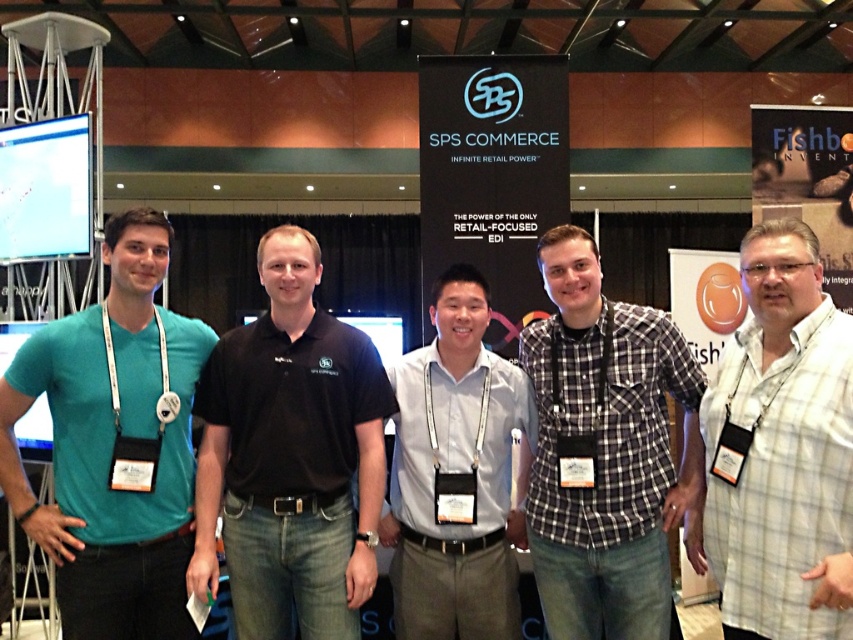
Question: Among these objects, which one is nearest to the camera?

Choices:
 (A) black cotton polo shirt at center
 (B) light gray shirt at center
 (C) checkered fabric shirt at center

Answer: (A)

Question: Is white checkered shirt at center closer to camera compared to light gray shirt at center?

Choices:
 (A) no
 (B) yes

Answer: (B)

Question: Can you confirm if white checkered shirt at center is positioned to the right of checkered fabric shirt at center?

Choices:
 (A) no
 (B) yes

Answer: (B)

Question: Which of the following is the farthest from the observer?

Choices:
 (A) black cotton polo shirt at center
 (B) white checkered shirt at center
 (C) checkered fabric shirt at center
 (D) teal matte t-shirt at left

Answer: (C)

Question: Considering the relative positions of black cotton polo shirt at center and checkered fabric shirt at center in the image provided, where is black cotton polo shirt at center located with respect to checkered fabric shirt at center?

Choices:
 (A) left
 (B) right

Answer: (A)

Question: Which point is farther to the camera?

Choices:
 (A) coord(289,531)
 (B) coord(468,321)

Answer: (B)